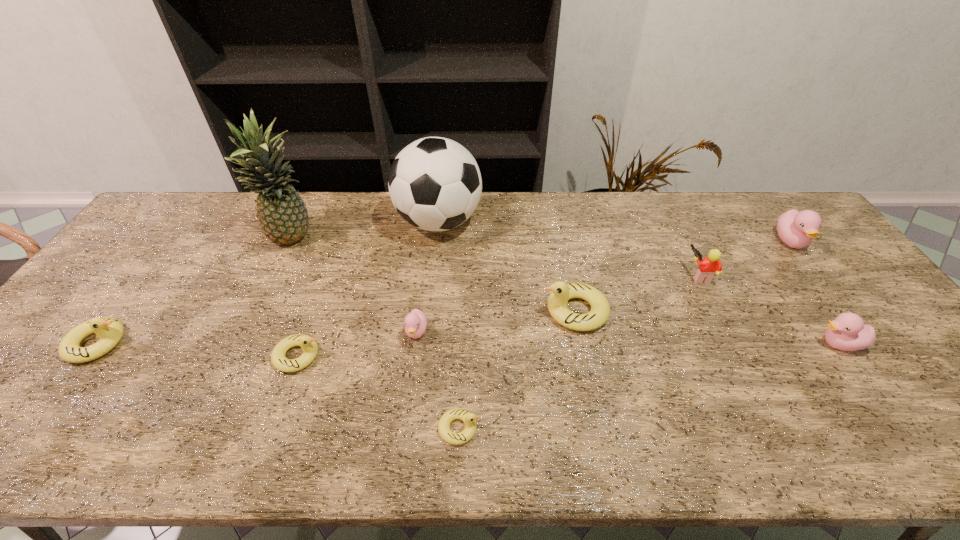
The height and width of the screenshot is (540, 960). Identify the location of green pineapple. (283, 216).

I want to click on pineapple, so click(x=283, y=216).

Locate an element on the screen. The height and width of the screenshot is (540, 960). soccer ball is located at coordinates (435, 184).

Locate an element on the screen. This screenshot has height=540, width=960. black soccer ball is located at coordinates (435, 184).

I want to click on the farthest duckling, so click(796, 229).

Identify the location of the biggest pink duckling. The image size is (960, 540). (796, 229).

The image size is (960, 540). I want to click on the third object from right to left, so click(710, 265).

Where is `Lego`? Lego is located at coordinates (710, 265).

Locate an element on the screen. The height and width of the screenshot is (540, 960). the biggest yellow duckling is located at coordinates (561, 292).

Where is `the third duckling from right to left`? The width and height of the screenshot is (960, 540). the third duckling from right to left is located at coordinates point(561,292).